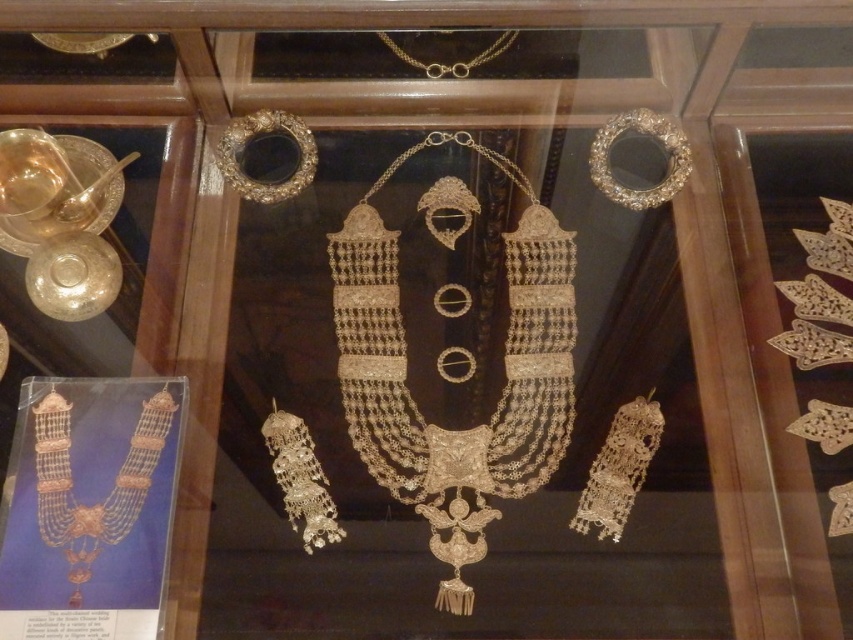
What do you see at coordinates (109, 492) in the screenshot? I see `gold textured necklace at lower left` at bounding box center [109, 492].

Which is above, gold textured necklace at lower left or silver textured earrings at right?

silver textured earrings at right is higher up.

Is point (61, 486) positioned behind point (839, 344)?

No.

This screenshot has height=640, width=853. I want to click on gold textured necklace at lower left, so click(109, 492).

Is silver textured earrings at right behind silver/metallic dangling earrings at lower left?

No, it is not.

Which is in front, point (820, 332) or point (294, 465)?

Positioned in front is point (294, 465).

Where is `silver textured earrings at right`? Image resolution: width=853 pixels, height=640 pixels. silver textured earrings at right is located at coordinates (820, 294).

Who is more distant from viewer, (96, 513) or (453, 67)?

Point (453, 67)

Who is taller, gold textured necklace at lower left or gold chain at upper center?

gold textured necklace at lower left is taller.

The width and height of the screenshot is (853, 640). Identify the location of gold textured necklace at lower left. (109, 492).